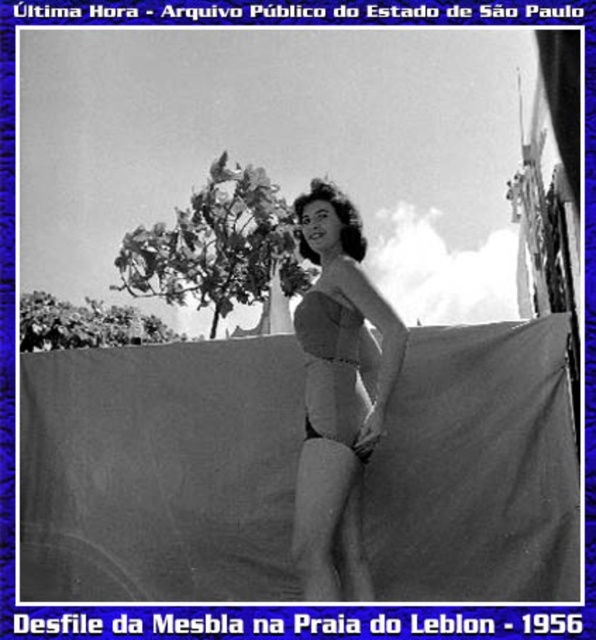
Question: Which of the following is the farthest from the observer?

Choices:
 (A) gray fabric at center
 (B) smooth fabric swimsuit at center

Answer: (A)

Question: Where is gray fabric at center located in relation to matte fabric bikini top at center in the image?

Choices:
 (A) left
 (B) right

Answer: (A)

Question: Which point is closer to the camera taking this photo?

Choices:
 (A) (312, 330)
 (B) (315, 352)

Answer: (A)

Question: Is gray fabric at center further to the viewer compared to smooth fabric swimsuit at center?

Choices:
 (A) yes
 (B) no

Answer: (A)

Question: Does gray fabric at center appear on the right side of smooth fabric swimsuit at center?

Choices:
 (A) no
 (B) yes

Answer: (A)

Question: Considering the real-world distances, which object is closest to the smooth fabric swimsuit at center?

Choices:
 (A) gray fabric at center
 (B) matte fabric bikini top at center

Answer: (B)